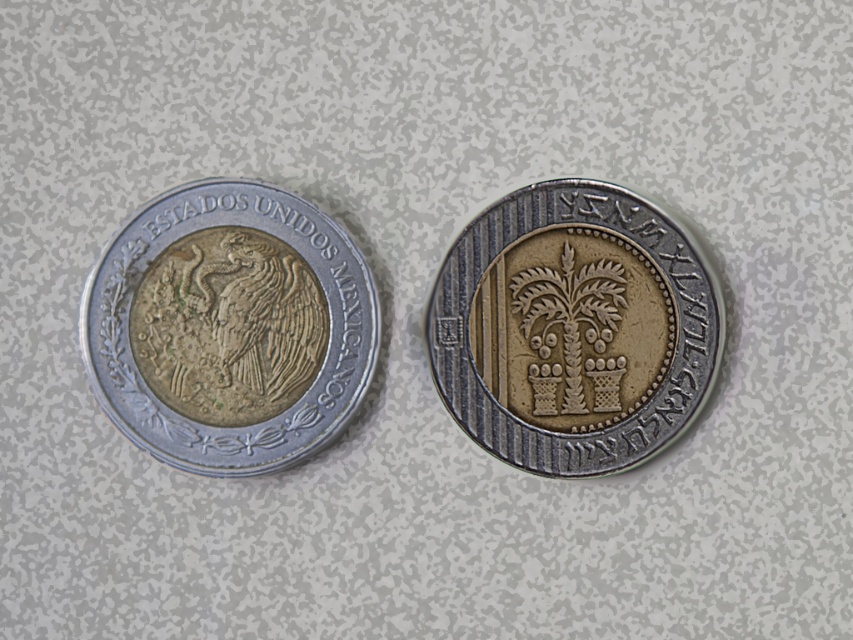
You are an archaeologist examining two ancient coins. The first coin has an eagle design with the text around it, and the second coin has a different design. You need to place a label at the point with coordinates (229, 326). Which coin should the label point to?

The point (229, 326) corresponds to the silver metallic coin at left, so the label should point to the silver metallic coin at left.

You are a collector who wants to place both coins in a display case that has a minimum required distance of 20 inches between any two items. Given that you have the silver metallic coin at left and another coin at right, will the current spacing between them meet the display case requirements?

The silver metallic coin at left and the other coin at right are 21.88 inches apart, which exceeds the 20 inch minimum requirement, so yes, the spacing meets the display case requirements.